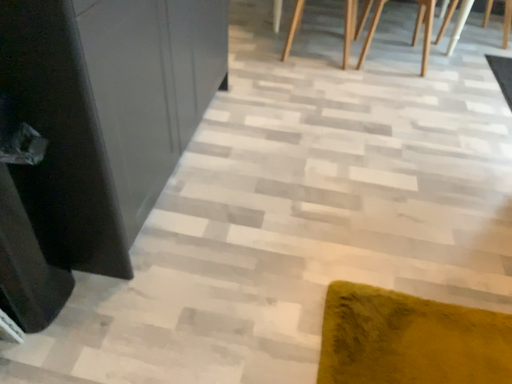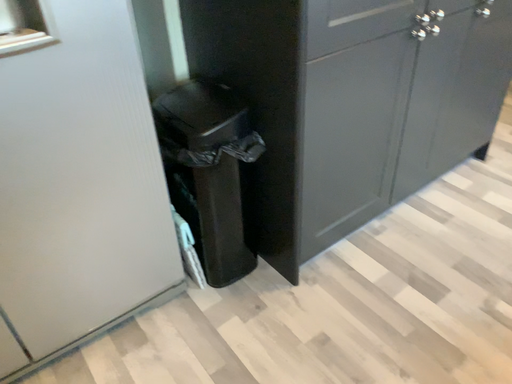
Question: Which way did the camera rotate in the video?

Choices:
 (A) rotated right
 (B) rotated left

Answer: (B)